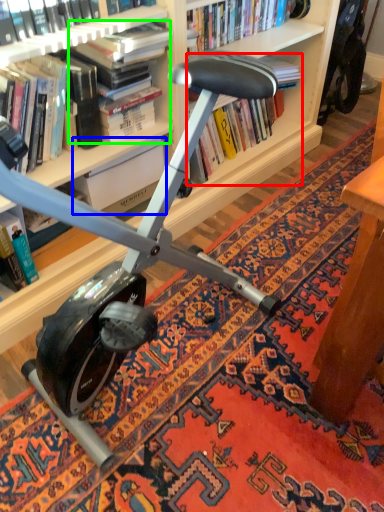
Question: Which object is the closest to the book (highlighted by a red box)? Choose among these: paperback book (highlighted by a blue box) or book (highlighted by a green box).

Choices:
 (A) paperback book
 (B) book

Answer: (A)